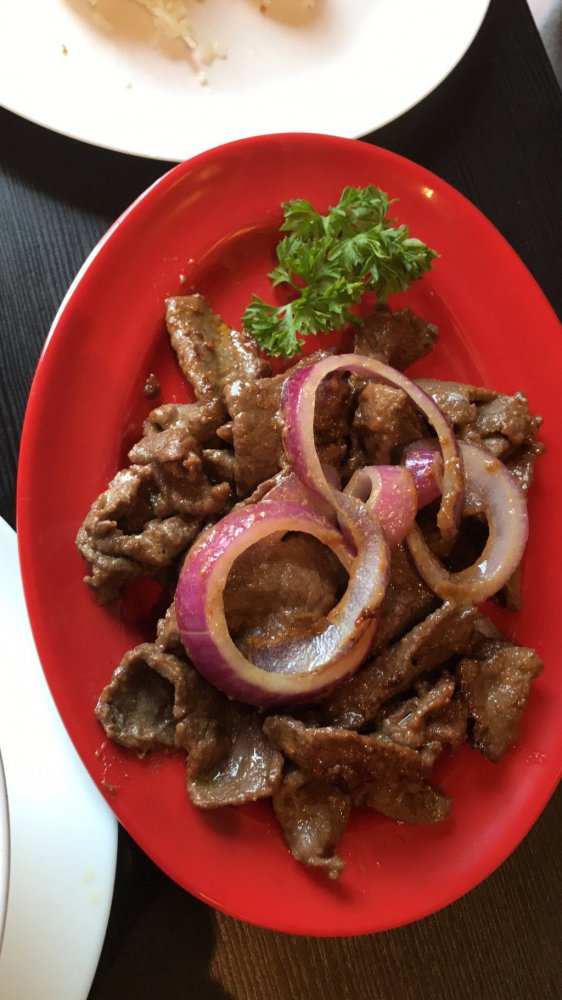
At what (x,y) coordinates should I click in order to perform the action: click on red plate. Please return your answer as a coordinate pair (x, y). Image resolution: width=562 pixels, height=1000 pixels. Looking at the image, I should click on (x=217, y=861).